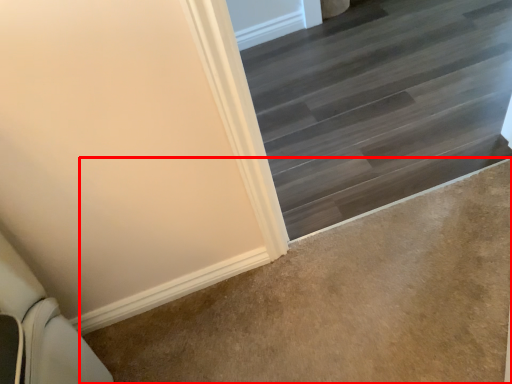
Question: From the image's perspective, what is the correct spatial relationship of concrete (annotated by the red box) in relation to stairs?

Choices:
 (A) above
 (B) below

Answer: (B)